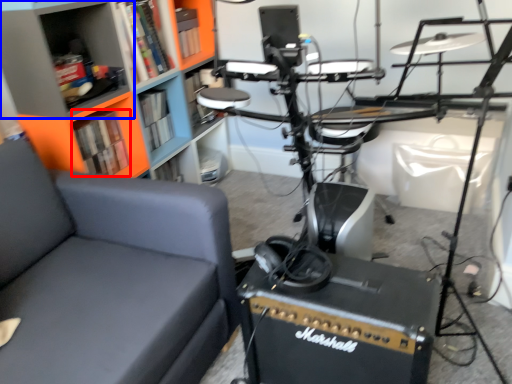
Question: Among these objects, which one is farthest to the camera, book (highlighted by a red box) or shelf (highlighted by a blue box)?

Choices:
 (A) book
 (B) shelf

Answer: (A)